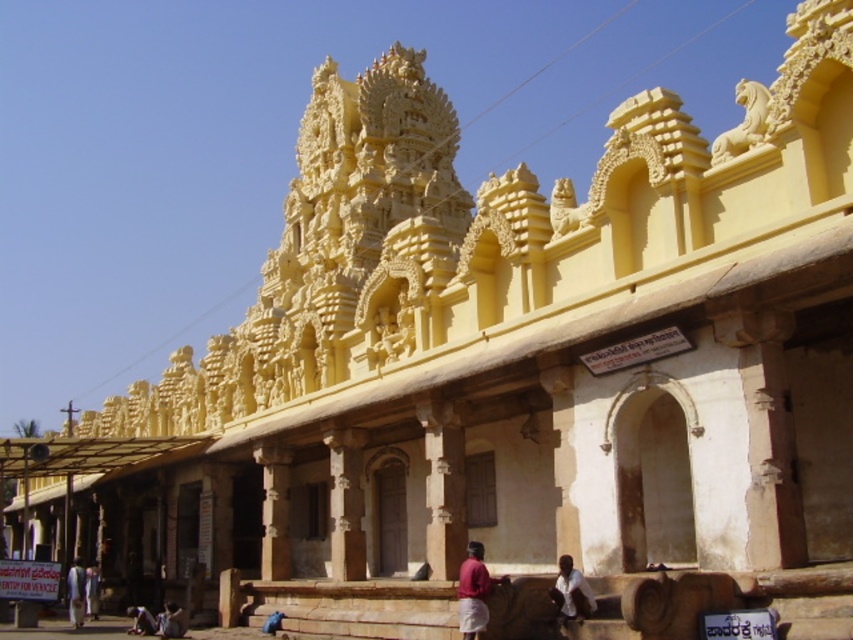
Question: Among these objects, which one is farthest from the camera?

Choices:
 (A) white fabric person at lower left
 (B) matte red cloth at lower right

Answer: (A)

Question: Observing the image, what is the correct spatial positioning of matte red cloth at lower right in reference to white cotton cloth at lower left?

Choices:
 (A) below
 (B) above

Answer: (B)

Question: Among these points, which one is nearest to the camera?

Choices:
 (A) tap(465, 600)
 (B) tap(90, 608)

Answer: (A)

Question: Which object is closer to the camera taking this photo?

Choices:
 (A) white cotton cloth at lower center
 (B) light skin human at lower left
 (C) white fabric person at lower left

Answer: (A)

Question: Does white cotton cloth at lower center appear over light blue fabric pants at lower left?

Choices:
 (A) yes
 (B) no

Answer: (A)

Question: Can you confirm if white fabric person at lower left is wider than light skin human at lower left?

Choices:
 (A) no
 (B) yes

Answer: (B)